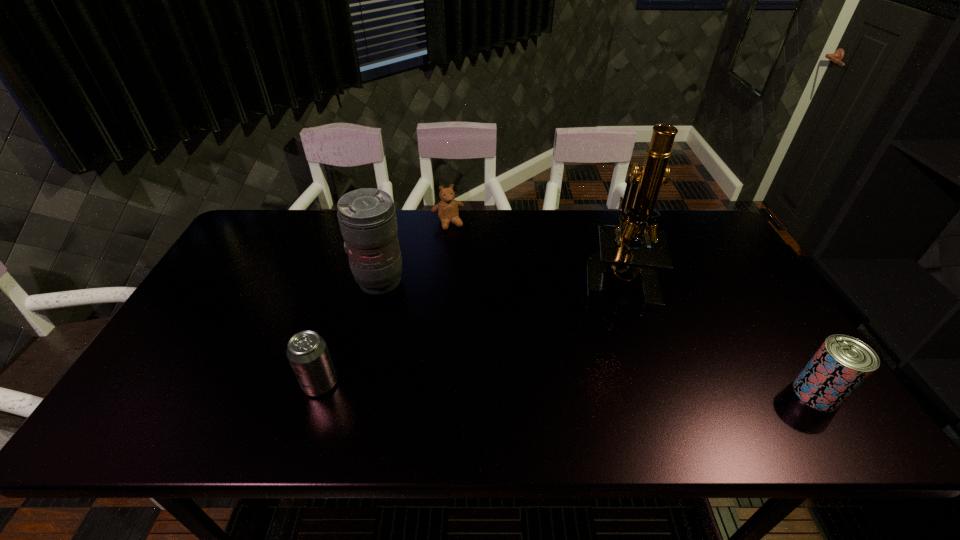
Where is `free space between the farthest object and the telephoto lens`? free space between the farthest object and the telephoto lens is located at coordinates (414, 252).

At what (x,y) coordinates should I click in order to perform the action: click on vacant space in between the telephoto lens and the third object from right to left. Please return your answer as a coordinate pair (x, y). The image size is (960, 540). Looking at the image, I should click on (414, 252).

Identify the location of vacant point located between the rightmost object and the telephoto lens. This screenshot has height=540, width=960. (598, 338).

The width and height of the screenshot is (960, 540). Identify the location of free space between the fourth shortest object and the tallest object. (498, 279).

This screenshot has width=960, height=540. Identify the location of vacant space in between the second tallest object and the rightmost object. 598,338.

This screenshot has height=540, width=960. In order to click on blank region between the telephoto lens and the left beer can in this screenshot , I will do `click(350, 333)`.

The width and height of the screenshot is (960, 540). Find the location of `blank region between the third object from right to left and the right beer can`. blank region between the third object from right to left and the right beer can is located at coordinates (633, 308).

Locate which object ranks third in proximity to the tallest object. Please provide its 2D coordinates. Your answer should be formatted as a tuple, i.e. [(x, y)], where the tuple contains the x and y coordinates of a point satisfying the conditions above.

[(367, 217)]

Select which object is the closest to the third object from left to right. Please provide its 2D coordinates. Your answer should be formatted as a tuple, i.e. [(x, y)], where the tuple contains the x and y coordinates of a point satisfying the conditions above.

[(367, 217)]

Image resolution: width=960 pixels, height=540 pixels. I want to click on free space that satisfies the following two spatial constraints: 1. on the back side of the second tallest object; 2. on the right side of the left beer can, so click(352, 281).